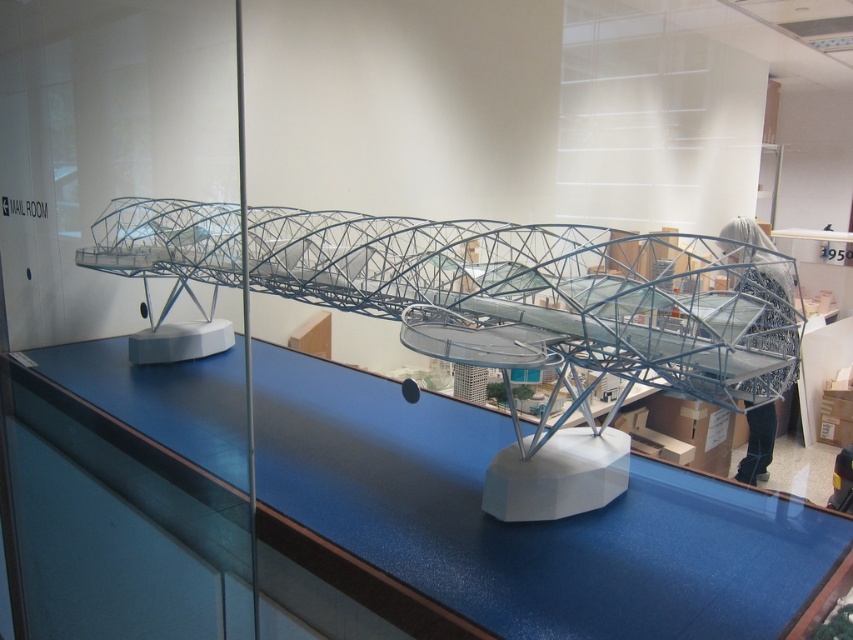
You are an architect examining the model of the bridge. You notice the transparent glass table at center and the metallic wireframe bridge at center. Which object is nearer to you in the scene?

The transparent glass table at center is closer to the viewer than the metallic wireframe bridge at center, so the transparent glass table at center is nearer.

You are an architect examining the model of the futuristic bridge. You need to place a 10cm wide scale model of a person on the transparent glass table at center without overlapping the metallic wireframe bridge at center. Is this possible given their widths?

The transparent glass table at center is wider than the metallic wireframe bridge at center. Since the table is wider, there should be enough space to place the 10cm wide scale model of a person on the transparent glass table at center without overlapping the metallic wireframe bridge at center.